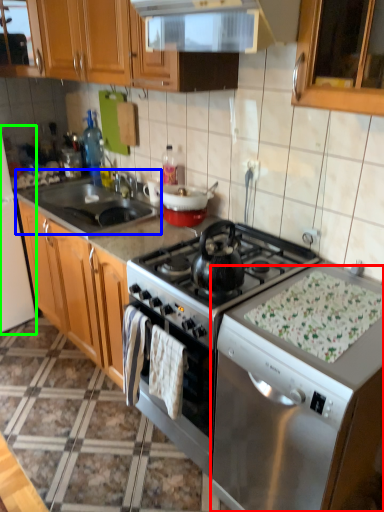
Question: Based on their relative distances, which object is nearer to dish washer (highlighted by a red box)? Choose from sink (highlighted by a blue box) and appliance (highlighted by a green box).

Choices:
 (A) sink
 (B) appliance

Answer: (A)